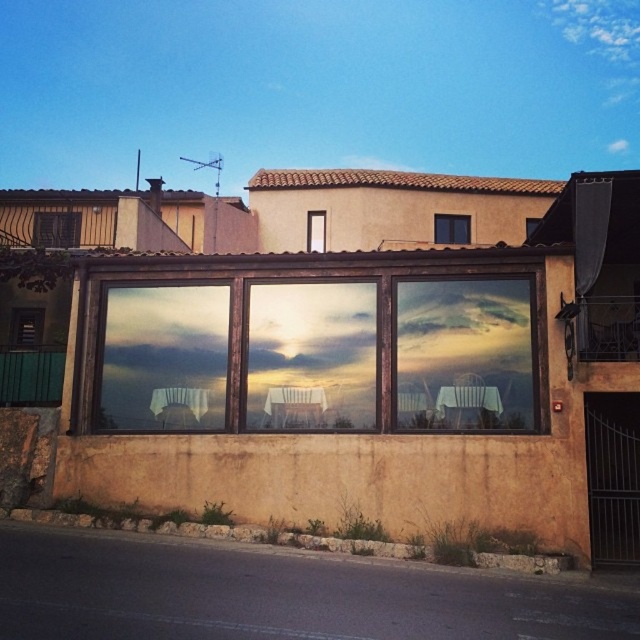
Question: Which object is closer to the camera taking this photo?

Choices:
 (A) transparent glass windows at center
 (B) black glass window at upper center
 (C) transparent glass window at center
 (D) matte black vent at upper left

Answer: (A)

Question: Which point is farther to the camera?

Choices:
 (A) matte black vent at upper left
 (B) transparent glass windows at center

Answer: (A)

Question: Does transparent glass windows at center appear on the right side of black glass window at upper center?

Choices:
 (A) no
 (B) yes

Answer: (A)

Question: Which point is farther to the camera?

Choices:
 (A) transparent glass window at center
 (B) matte glass window at lower left
 (C) transparent glass windows at center

Answer: (A)

Question: Does black glass window at upper center have a smaller size compared to transparent glass door at center?

Choices:
 (A) no
 (B) yes

Answer: (A)

Question: Does transparent glass windows at center appear under transparent glass window at center?

Choices:
 (A) no
 (B) yes

Answer: (B)